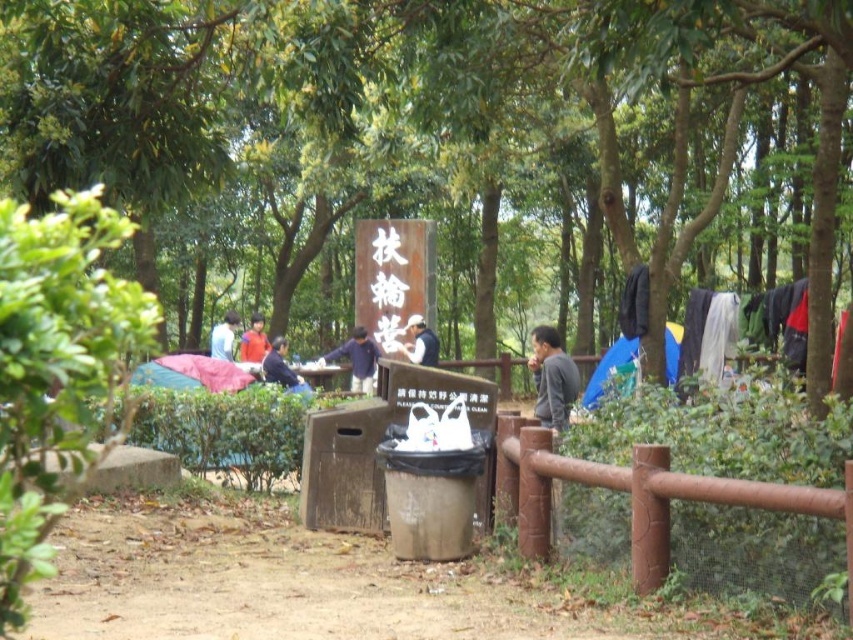
You are a photographer standing at the edge of the dirt path and want to take a photo of the green leafy tree at center and the dark blue shirt at center. Which object should you focus on first to ensure both are in frame?

The green leafy tree at center is above the dark blue shirt at center, so you should focus on the dark blue shirt at center first to ensure both are in frame.

You are a photographer trying to capture a picture of the dark blue shirt at center without the green leafy tree at center blocking the view. Is there a way to position yourself so that the tree doesn not obstruct the shirt?

The green leafy tree at center is much taller than the dark blue shirt at center, so positioning yourself lower or moving closer to the shirt might allow you to frame the shot without the tree blocking the view.